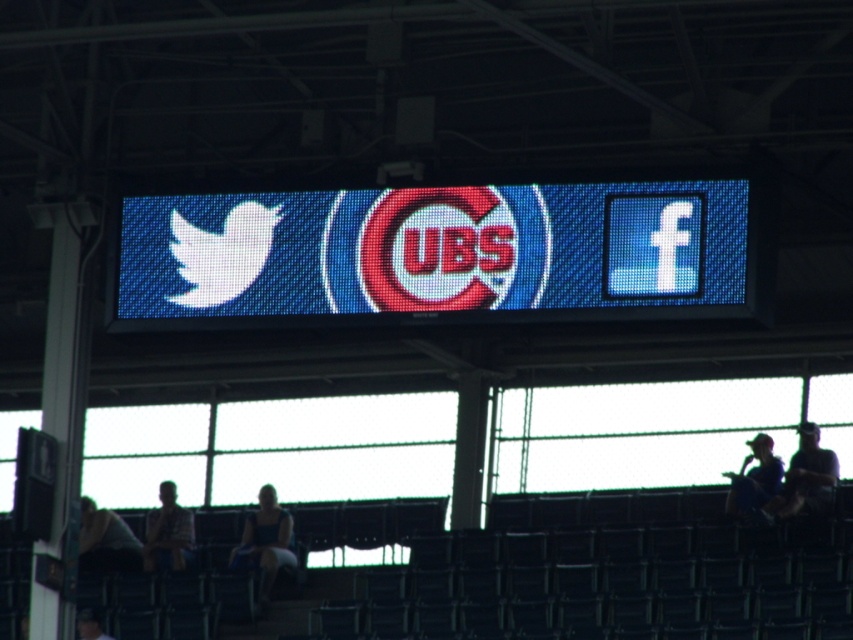
Question: Which of the following is the closest to the observer?

Choices:
 (A) (154, 518)
 (B) (276, 492)
 (C) (816, 486)
 (D) (756, 440)

Answer: (C)

Question: Is the position of matte digital display at center more distant than that of dark gray fabric at lower left?

Choices:
 (A) no
 (B) yes

Answer: (A)

Question: Which of these objects is positioned farthest from the plaid shirt at lower left?

Choices:
 (A) dark blue shirt at lower right
 (B) dark gray fabric at lower left

Answer: (A)

Question: Is dark blue shirt at right below dark blue fabric at lower left?

Choices:
 (A) no
 (B) yes

Answer: (A)

Question: Is dark gray fabric at lower left thinner than dark blue shirt at lower right?

Choices:
 (A) no
 (B) yes

Answer: (B)

Question: Among these objects, which one is nearest to the camera?

Choices:
 (A) dark gray fabric at lower left
 (B) dark blue fabric at lower left
 (C) matte digital display at center
 (D) blue denim dress at lower center

Answer: (C)